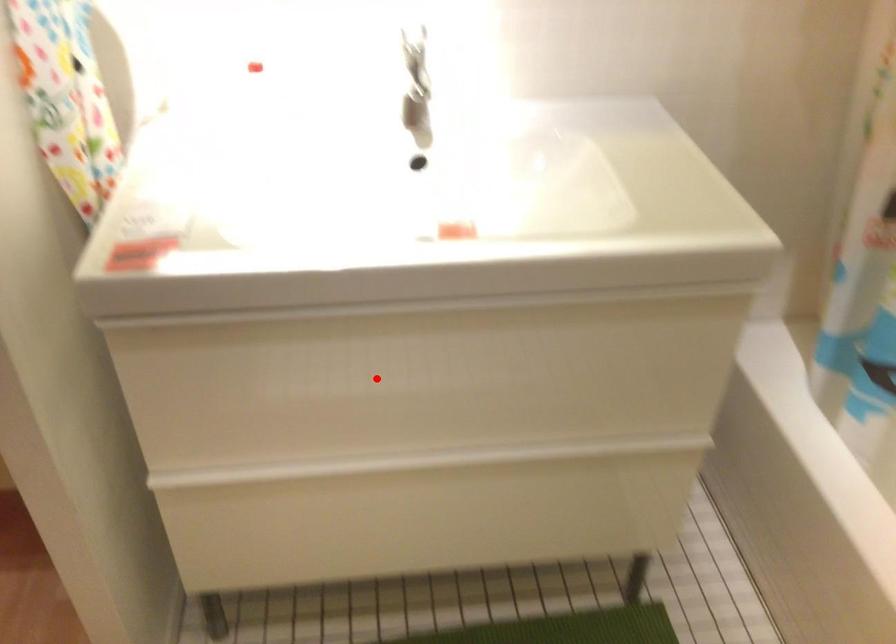
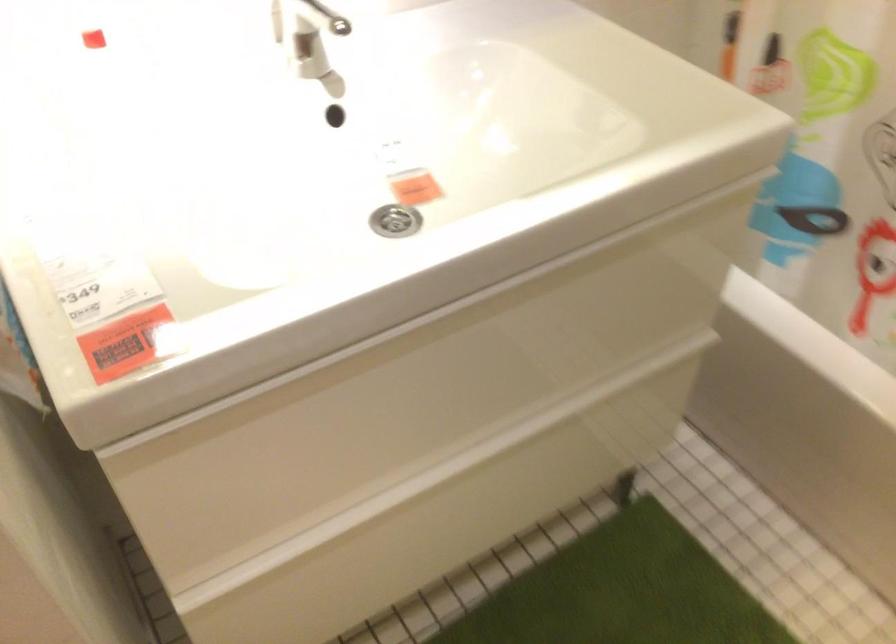
In the second image, find the point that corresponds to the highlighted location in the first image.

(423, 392)